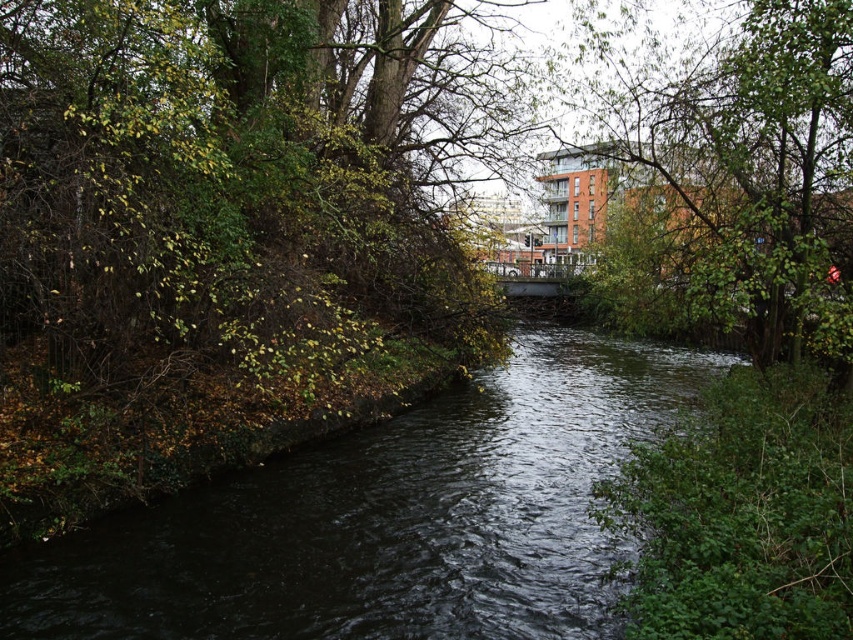
Which is above, dark water at center or green leafy tree at upper right?

green leafy tree at upper right is higher up.

Between point (544, 513) and point (764, 161), which one is positioned behind?

Point (764, 161)

The image size is (853, 640). I want to click on dark water at center, so click(x=386, y=518).